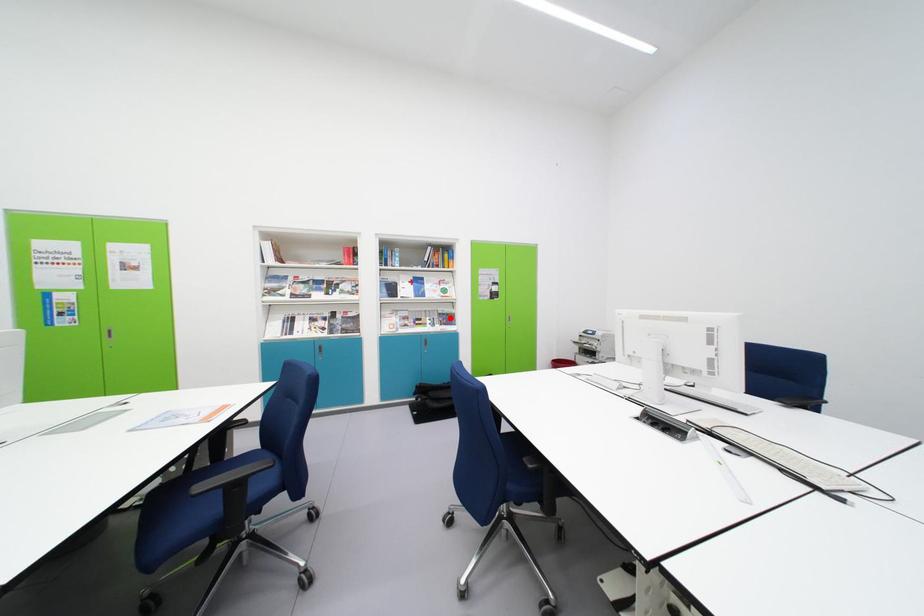
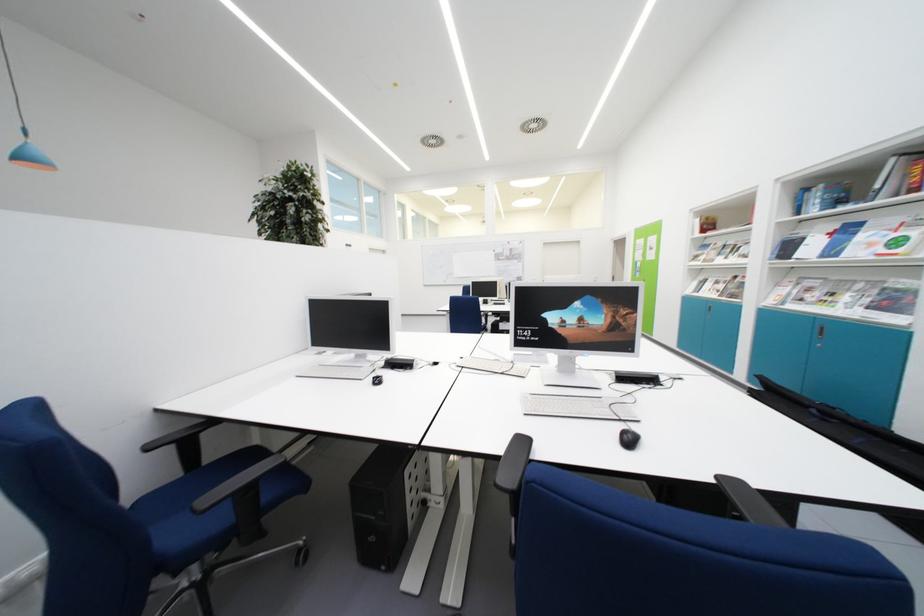
Question: I am providing you with two images of the same scene from different viewpoints. Image1 has a red point marked. In image2, the corresponding 3D location appears at what relative position? Reply with the corresponding letter.

Choices:
 (A) Closer
 (B) Farther

Answer: (B)